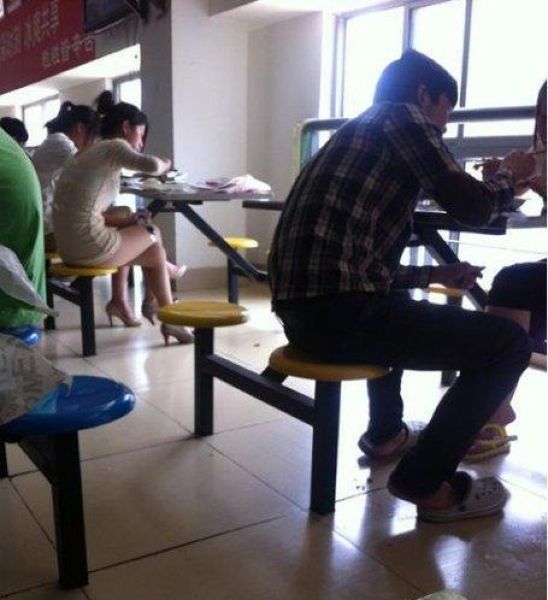
You are a GUI agent. You are given a task and a screenshot of the screen. Output one action in this format:
    pyautogui.click(x=<x>, y=<y>)
    Task: Click on the window
    The height and width of the screenshot is (600, 548).
    Given the screenshot: What is the action you would take?
    pyautogui.click(x=516, y=44)